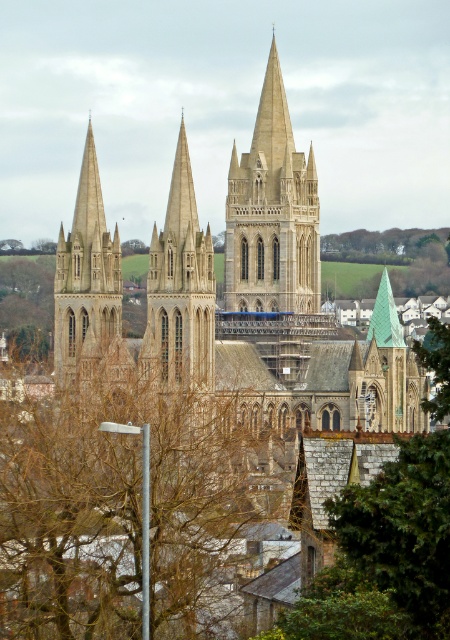
Does stone gothic cathedral at center appear over beige stone tower at center?

Correct, stone gothic cathedral at center is located above beige stone tower at center.

Can you confirm if stone gothic cathedral at center is smaller than beige stone tower at center?

No, stone gothic cathedral at center is not smaller than beige stone tower at center.

Does point (278, 273) come in front of point (194, 230)?

No, (278, 273) is further to viewer.

This screenshot has width=450, height=640. I want to click on stone gothic cathedral at center, so click(271, 212).

Does stone gothic cathedral at center appear over stone spire at left?

Correct, stone gothic cathedral at center is located above stone spire at left.

Describe the element at coordinates (271, 212) in the screenshot. I see `stone gothic cathedral at center` at that location.

Is point (301, 236) positioned before point (68, 330)?

No.

Find the location of a particular element. The height and width of the screenshot is (640, 450). stone gothic cathedral at center is located at coordinates (271, 212).

Locate an element on the screen. Image resolution: width=450 pixels, height=640 pixels. light beige stone church at center is located at coordinates (269, 298).

Is point (72, 365) farther from camera compared to point (239, 204)?

No.

Does point (81, 234) come closer to viewer compared to point (309, 310)?

Yes, point (81, 234) is closer to viewer.

Where is `light beige stone church at center`? The height and width of the screenshot is (640, 450). light beige stone church at center is located at coordinates (269, 298).